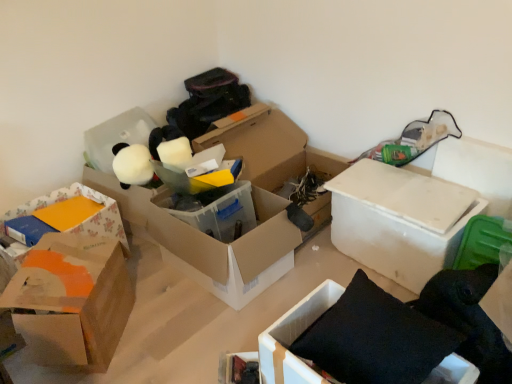
Question: From a real-world perspective, does floral paper box at left, marked as the 5th box in a right-to-left arrangement, stand above translucent plastic box at center, placed as the third box when sorted from left to right?

Choices:
 (A) yes
 (B) no

Answer: (A)

Question: Is floral paper box at left, which is the first box in left-to-right order, looking in the opposite direction of translucent plastic box at center, placed as the 3th box when sorted from right to left?

Choices:
 (A) no
 (B) yes

Answer: (A)

Question: Considering the relative sizes of floral paper box at left, which is the first box in left-to-right order, and translucent plastic box at center, placed as the 3th box when sorted from right to left, in the image provided, is floral paper box at left, which is the first box in left-to-right order, bigger than translucent plastic box at center, placed as the 3th box when sorted from right to left,?

Choices:
 (A) yes
 (B) no

Answer: (B)

Question: From the image's perspective, is floral paper box at left, which is the first box in left-to-right order, located beneath translucent plastic box at center, placed as the 3th box when sorted from right to left?

Choices:
 (A) no
 (B) yes

Answer: (A)

Question: Is translucent plastic box at center, placed as the third box when sorted from left to right, a part of floral paper box at left, which is the first box in left-to-right order?

Choices:
 (A) yes
 (B) no

Answer: (B)

Question: From a real-world perspective, is floral paper box at left, marked as the 5th box in a right-to-left arrangement, under translucent plastic box at center, placed as the third box when sorted from left to right?

Choices:
 (A) yes
 (B) no

Answer: (B)

Question: Is translucent plastic box at center, placed as the third box when sorted from left to right, oriented towards matte black book at lower center, the first storage box ordered from the bottom?

Choices:
 (A) yes
 (B) no

Answer: (B)

Question: From the image's perspective, would you say translucent plastic box at center, placed as the 3th box when sorted from right to left, is shown under matte black book at lower center, the second storage box from the back?

Choices:
 (A) no
 (B) yes

Answer: (A)

Question: From a real-world perspective, is translucent plastic box at center, placed as the 3th box when sorted from right to left, over matte black book at lower center, arranged as the second storage box when viewed from the left?

Choices:
 (A) no
 (B) yes

Answer: (B)

Question: Is matte black book at lower center, the 2th storage box from the top, at the back of translucent plastic box at center, placed as the 3th box when sorted from right to left?

Choices:
 (A) no
 (B) yes

Answer: (A)

Question: Is there a large distance between translucent plastic box at center, placed as the third box when sorted from left to right, and matte black book at lower center, arranged as the second storage box when viewed from the left?

Choices:
 (A) yes
 (B) no

Answer: (B)

Question: Is translucent plastic box at center, placed as the third box when sorted from left to right, not inside matte black book at lower center, arranged as the second storage box when viewed from the left?

Choices:
 (A) yes
 (B) no

Answer: (A)

Question: From a real-world perspective, is white cardboard box at center-right, the first box in the right-to-left sequence, physically below floral paper box at left, marked as the 5th box in a right-to-left arrangement?

Choices:
 (A) no
 (B) yes

Answer: (B)